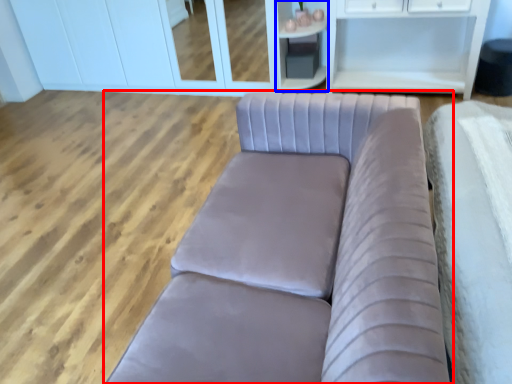
Question: Which of the following is the closest to the observer, studio couch (highlighted by a red box) or cabinetry (highlighted by a blue box)?

Choices:
 (A) studio couch
 (B) cabinetry

Answer: (A)